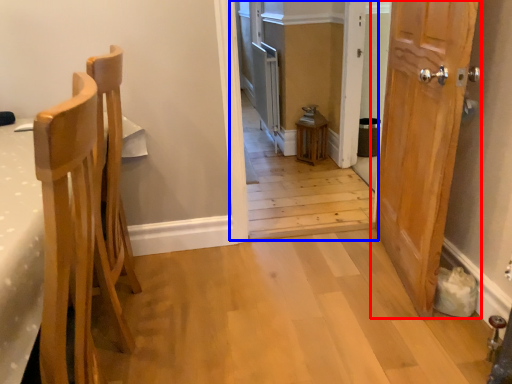
Question: Which object is further to the camera taking this photo, door (highlighted by a red box) or corridor (highlighted by a blue box)?

Choices:
 (A) door
 (B) corridor

Answer: (B)